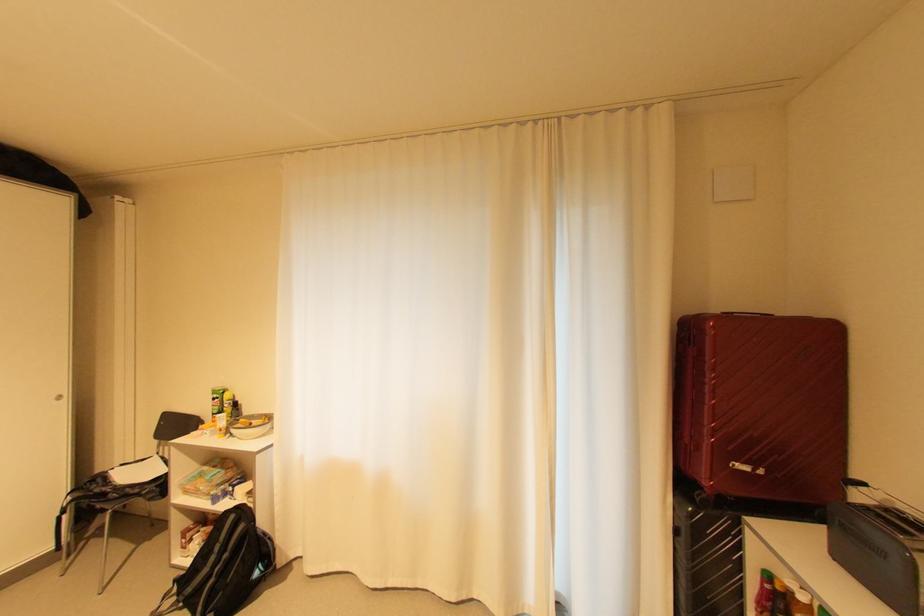
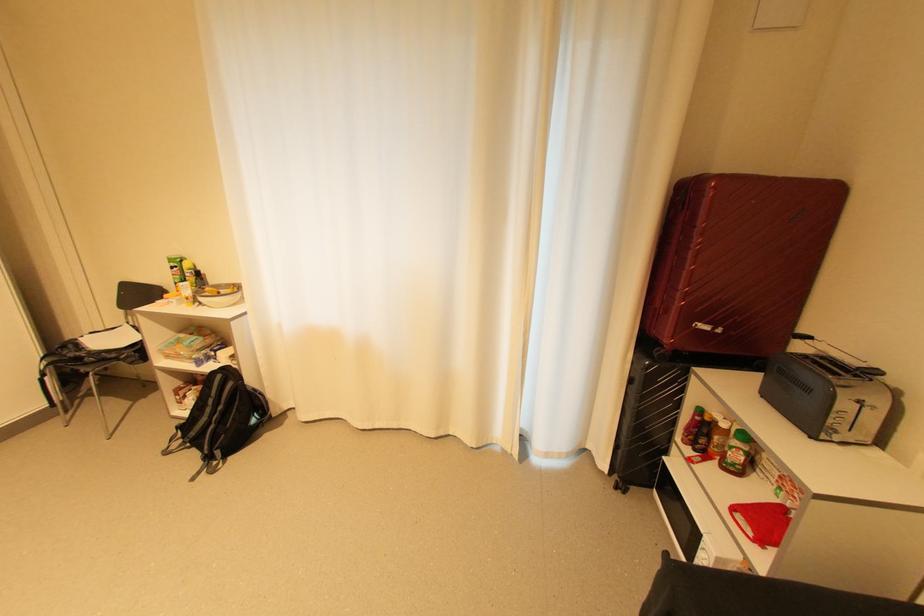
In the second image, find the point that corresponds to point 752,468 in the first image.

(713, 328)